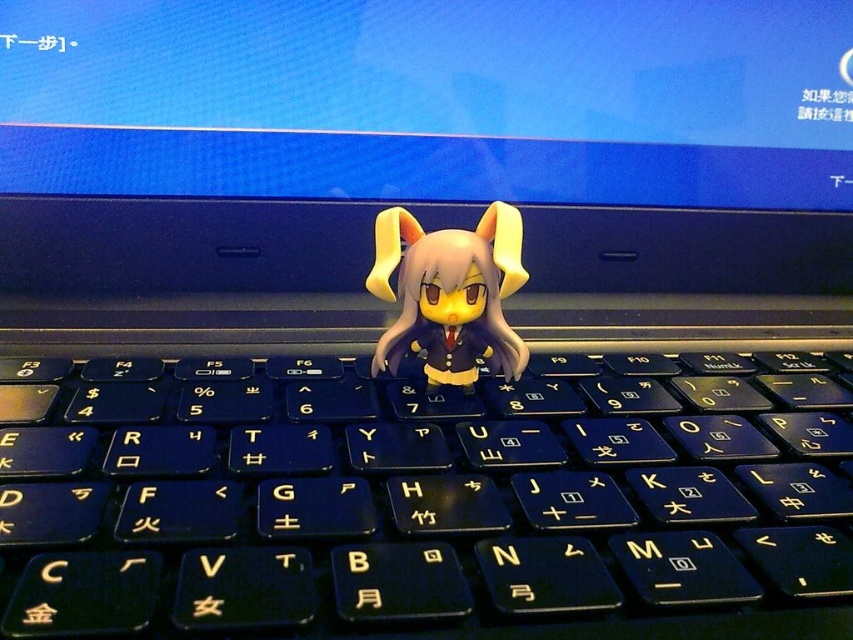
Can you confirm if black plastic keyboard at center is positioned to the right of matte yellow plastic toy at center?

Indeed, black plastic keyboard at center is positioned on the right side of matte yellow plastic toy at center.

Image resolution: width=853 pixels, height=640 pixels. Describe the element at coordinates (422, 497) in the screenshot. I see `black plastic keyboard at center` at that location.

The width and height of the screenshot is (853, 640). Find the location of `black plastic keyboard at center`. black plastic keyboard at center is located at coordinates (422, 497).